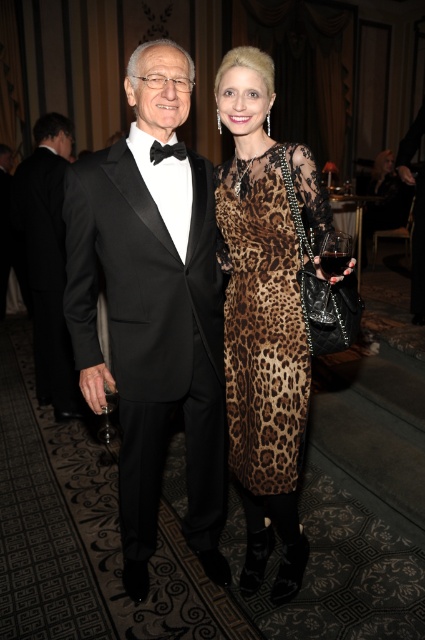
You are a photographer at a gala event. You need to capture a clear photo of the shiny black tuxedo at left and the transparent plastic wine glass at center. Since the lighting is low, you want to ensure the wine glass is visible. Which object should you focus on to ensure both are in focus?

The shiny black tuxedo at left has a larger size compared to transparent plastic wine glass at center, so focusing on the shiny black tuxedo at left will ensure both are in focus because it is closer to the camera.

You are standing at the point marked as point (133, 580) in the image. You want to walk straight towards the viewer. How far will you have to walk to reach the viewer?

The distance between point (133, 580) and the viewer is 1.96 meters, so you will have to walk 1.96 meters to reach the viewer.